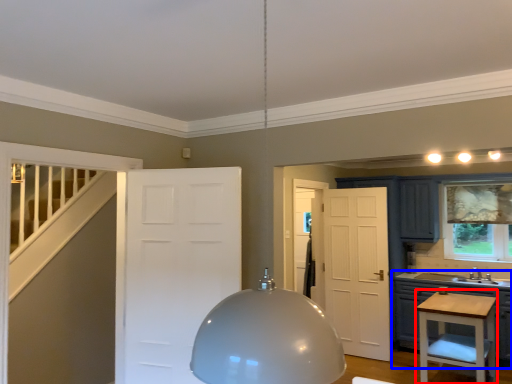
Question: Which of the following is the farthest to the observer, vanity (highlighted by a red box) or cabinetry (highlighted by a blue box)?

Choices:
 (A) vanity
 (B) cabinetry

Answer: (B)